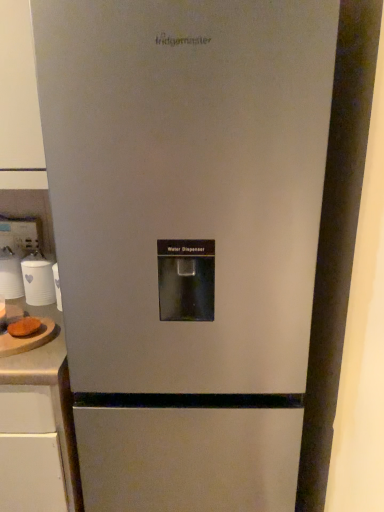
Question: Is white laminate counter at lower left, which ranks as the 2th counter top in top-to-bottom order, closer to the viewer compared to brown fuzzy bread at left?

Choices:
 (A) yes
 (B) no

Answer: (A)

Question: Would you say brown fuzzy bread at left is part of white laminate counter at lower left, which ranks as the 2th counter top in top-to-bottom order,'s contents?

Choices:
 (A) no
 (B) yes

Answer: (A)

Question: Can you confirm if white laminate counter at lower left, which ranks as the 2th counter top in top-to-bottom order, is positioned to the left of brown fuzzy bread at left?

Choices:
 (A) no
 (B) yes

Answer: (B)

Question: Does white laminate counter at lower left, which ranks as the 2th counter top in top-to-bottom order, lie behind brown fuzzy bread at left?

Choices:
 (A) no
 (B) yes

Answer: (A)

Question: Does white laminate counter at lower left, marked as the 1th counter top in a bottom-to-top arrangement, have a lesser height compared to brown fuzzy bread at left?

Choices:
 (A) yes
 (B) no

Answer: (B)

Question: From the image's perspective, is white laminate counter at lower left, which ranks as the 2th counter top in top-to-bottom order, on brown fuzzy bread at left?

Choices:
 (A) yes
 (B) no

Answer: (B)

Question: From the image's perspective, is brown fuzzy bread at left beneath wooden cutting board at left, acting as the 2th counter top starting from the bottom?

Choices:
 (A) yes
 (B) no

Answer: (B)

Question: Does brown fuzzy bread at left have a lesser width compared to wooden cutting board at left, which ranks as the first counter top in top-to-bottom order?

Choices:
 (A) no
 (B) yes

Answer: (B)

Question: Does brown fuzzy bread at left turn towards wooden cutting board at left, acting as the 2th counter top starting from the bottom?

Choices:
 (A) no
 (B) yes

Answer: (A)

Question: Considering the relative positions of brown fuzzy bread at left and wooden cutting board at left, acting as the 2th counter top starting from the bottom, in the image provided, is brown fuzzy bread at left behind wooden cutting board at left, acting as the 2th counter top starting from the bottom,?

Choices:
 (A) no
 (B) yes

Answer: (B)

Question: Is brown fuzzy bread at left far from wooden cutting board at left, acting as the 2th counter top starting from the bottom?

Choices:
 (A) no
 (B) yes

Answer: (A)

Question: From a real-world perspective, is brown fuzzy bread at left located beneath wooden cutting board at left, which ranks as the first counter top in top-to-bottom order?

Choices:
 (A) yes
 (B) no

Answer: (B)

Question: Is white laminate counter at lower left, which ranks as the 2th counter top in top-to-bottom order, beside white matte cup at left, which is the first appliance from right to left?

Choices:
 (A) no
 (B) yes

Answer: (A)